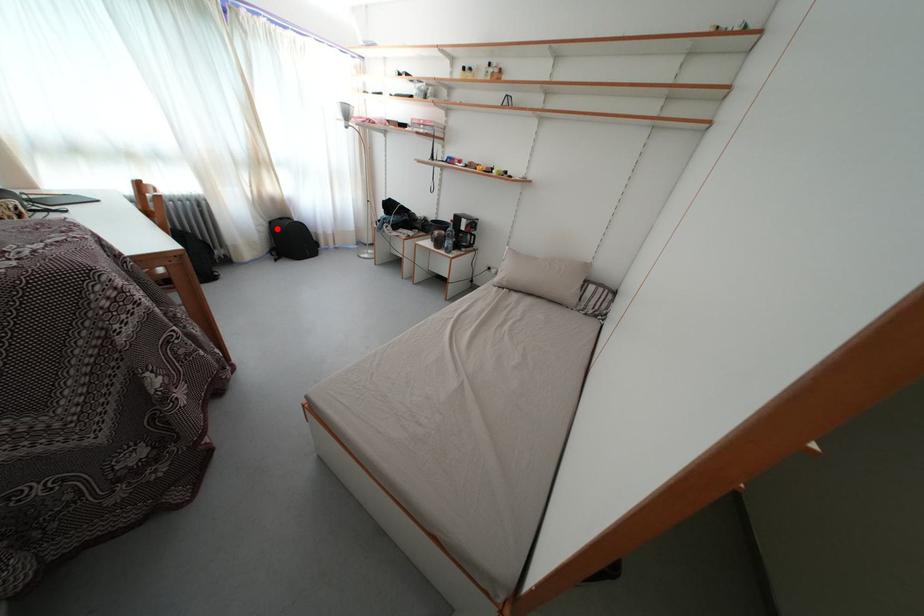
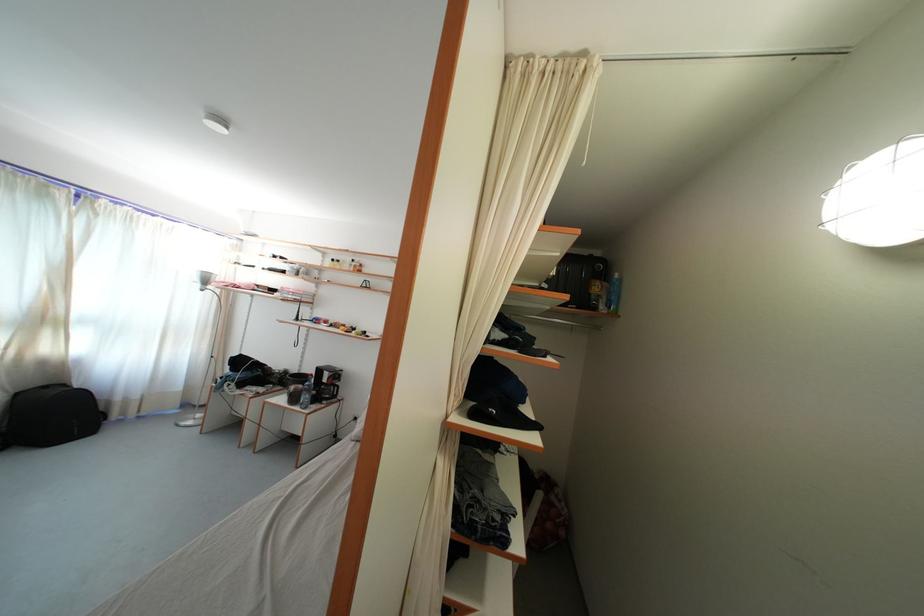
Question: A red point is marked in image1. In image2, is the corresponding 3D point closer to the camera or farther? Reply with the corresponding letter.

Choices:
 (A) The corresponding 3D point is closer.
 (B) The corresponding 3D point is farther.

Answer: (B)